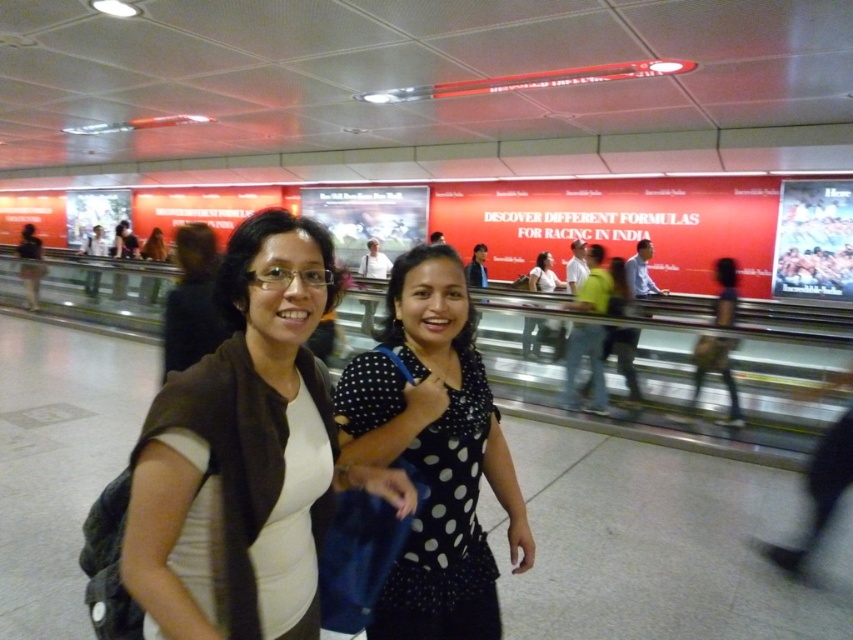
Who is shorter, white matte shirt at center or black dotted dress at center?

white matte shirt at center

Consider the image. Is white matte shirt at center taller than black dotted dress at center?

Incorrect, white matte shirt at center's height is not larger of black dotted dress at center's.

Between point (231, 460) and point (451, 486), which one is positioned behind?

The point (451, 486) is more distant.

Where is `white matte shirt at center`? Image resolution: width=853 pixels, height=640 pixels. white matte shirt at center is located at coordinates (245, 456).

Is white matte shirt at center shorter than polka dot blouse at center?

No, white matte shirt at center is not shorter than polka dot blouse at center.

Can you confirm if white matte shirt at center is bigger than polka dot blouse at center?

Correct, white matte shirt at center is larger in size than polka dot blouse at center.

Is point (183, 436) more distant than point (549, 289)?

No, (183, 436) is in front of (549, 289).

Where is `white matte shirt at center`? Image resolution: width=853 pixels, height=640 pixels. white matte shirt at center is located at coordinates (245, 456).

I want to click on black dotted dress at center, so click(434, 452).

Can you confirm if black dotted dress at center is smaller than polka dot blouse at center?

Actually, black dotted dress at center might be larger than polka dot blouse at center.

Locate an element on the screen. black dotted dress at center is located at coordinates coord(434,452).